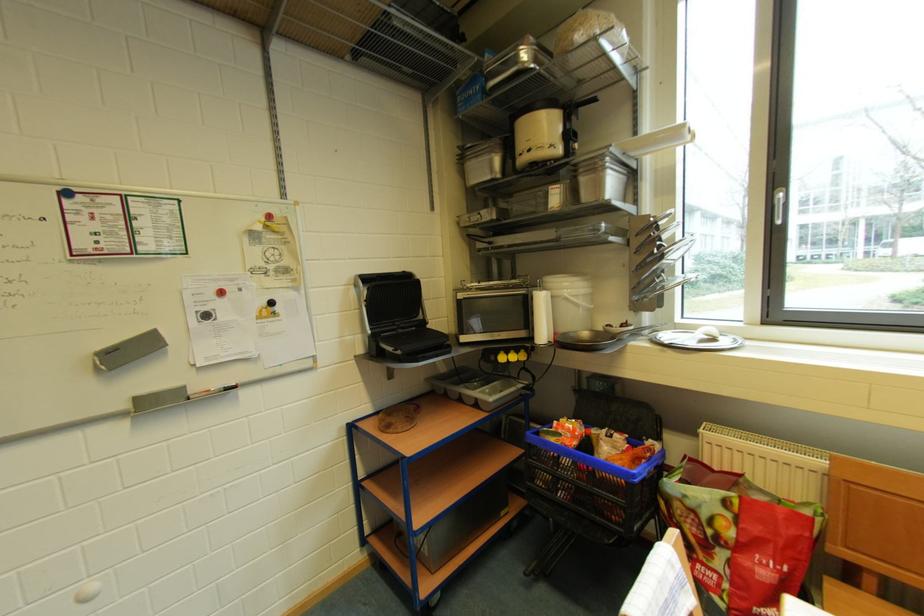
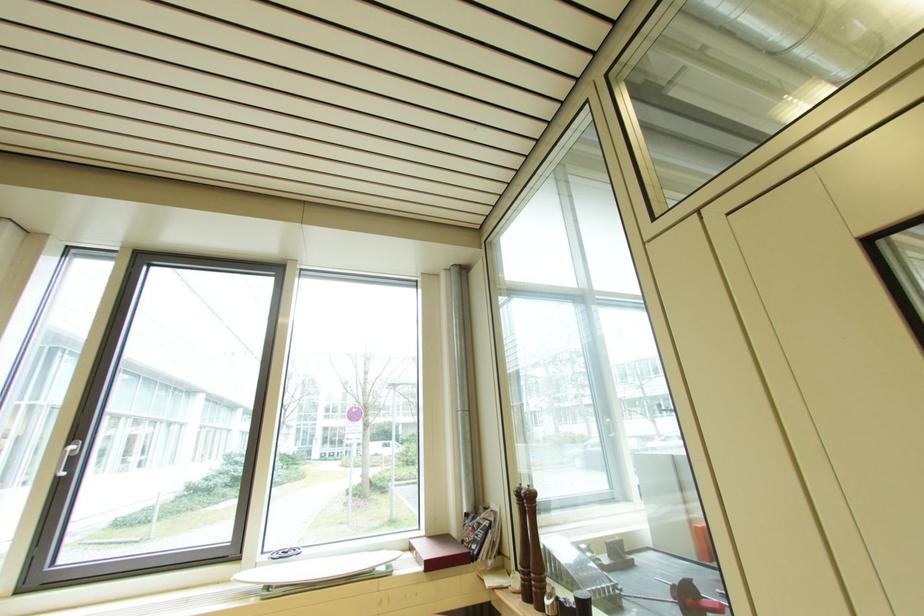
Locate, in the second image, the point that corresponds to point 785,204 in the first image.

(73, 455)